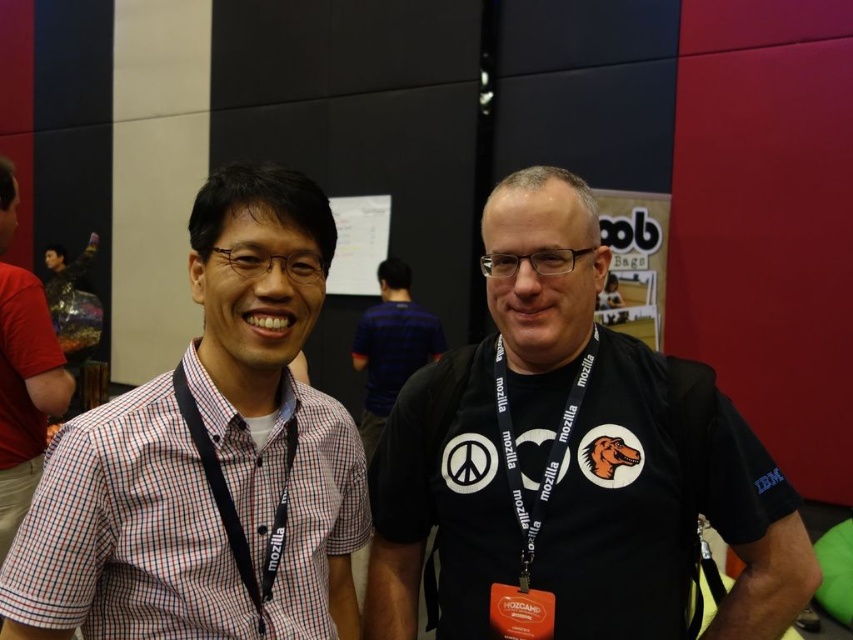
You are a photographer at an event and notice two items on the left side of the image. The first is the checkered shirt at left, and the second is the black fabric lanyard at left. Which of these items is positioned higher up in the image?

The checkered shirt at left is much taller as the black fabric lanyard at left, so the checkered shirt at left is positioned higher up in the image.

From the picture: You are a photographer at a conference. You want to take a photo of the checkered shirt at left and the black fabric lanyard at left. Which object should you zoom in on to capture both in the frame without cropping?

The checkered shirt at left is larger in size than the black fabric lanyard at left, so you should zoom in on the checkered shirt at left to ensure both objects fit in the frame without cropping.